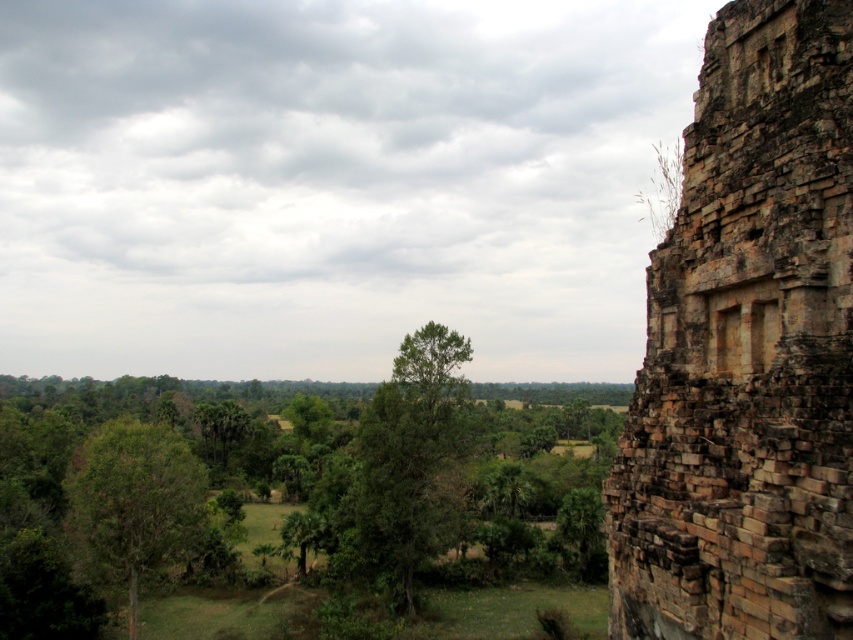
Question: Which object appears farthest from the camera in this image?

Choices:
 (A) brown stone wall at right
 (B) green leafy tree at left

Answer: (B)

Question: Is brown stone wall at right to the right of green leafy tree at center from the viewer's perspective?

Choices:
 (A) yes
 (B) no

Answer: (A)

Question: Does green leafy tree at center appear under green leafy tree at left?

Choices:
 (A) yes
 (B) no

Answer: (B)

Question: Which of the following is the closest to the observer?

Choices:
 (A) green leafy tree at center
 (B) brown stone wall at right
 (C) green leafy tree at left

Answer: (B)

Question: Can you confirm if green leafy tree at center is positioned below green leafy tree at left?

Choices:
 (A) no
 (B) yes

Answer: (A)

Question: Which of these objects is positioned farthest from the green leafy tree at left?

Choices:
 (A) green leafy tree at center
 (B) brown stone wall at right

Answer: (B)